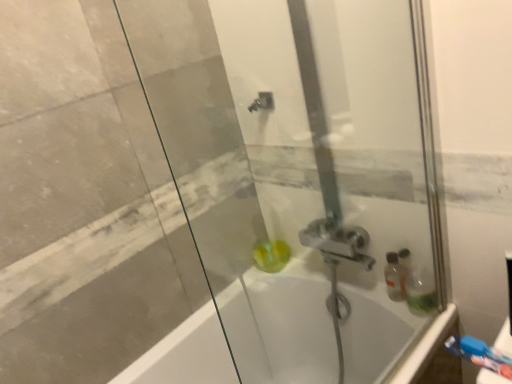
Question: Is translucent green soap at center not inside blue plastic toothbrush at lower right?

Choices:
 (A) no
 (B) yes

Answer: (B)

Question: Is translucent green soap at center positioned with its back to blue plastic toothbrush at lower right?

Choices:
 (A) yes
 (B) no

Answer: (B)

Question: From a real-world perspective, is translucent green soap at center physically above blue plastic toothbrush at lower right?

Choices:
 (A) yes
 (B) no

Answer: (B)

Question: Is the position of translucent green soap at center less distant than that of blue plastic toothbrush at lower right?

Choices:
 (A) yes
 (B) no

Answer: (B)

Question: From the image's perspective, does translucent green soap at center appear higher than blue plastic toothbrush at lower right?

Choices:
 (A) no
 (B) yes

Answer: (B)

Question: Looking at their shapes, would you say blue plastic toothbrush at lower right is wider or thinner than transparent glass shower door at center?

Choices:
 (A) wide
 (B) thin

Answer: (A)

Question: From their relative heights in the image, would you say blue plastic toothbrush at lower right is taller or shorter than transparent glass shower door at center?

Choices:
 (A) short
 (B) tall

Answer: (A)

Question: Based on their sizes in the image, would you say blue plastic toothbrush at lower right is bigger or smaller than transparent glass shower door at center?

Choices:
 (A) small
 (B) big

Answer: (A)

Question: Considering their positions, is blue plastic toothbrush at lower right located in front of or behind transparent glass shower door at center?

Choices:
 (A) front
 (B) behind

Answer: (B)

Question: Based on their sizes in the image, would you say translucent green soap at center is bigger or smaller than white glossy bathtub at center?

Choices:
 (A) small
 (B) big

Answer: (A)

Question: In the image, is translucent green soap at center on the left side or the right side of white glossy bathtub at center?

Choices:
 (A) right
 (B) left

Answer: (B)

Question: Is translucent green soap at center inside the boundaries of white glossy bathtub at center, or outside?

Choices:
 (A) inside
 (B) outside

Answer: (B)

Question: From the image's perspective, is translucent green soap at center located above or below white glossy bathtub at center?

Choices:
 (A) above
 (B) below

Answer: (A)

Question: Considering the positions of translucent green soap at center and transparent glass shower door at center in the image, is translucent green soap at center wider or thinner than transparent glass shower door at center?

Choices:
 (A) thin
 (B) wide

Answer: (B)

Question: From a real-world perspective, is translucent green soap at center physically located above or below transparent glass shower door at center?

Choices:
 (A) below
 (B) above

Answer: (A)